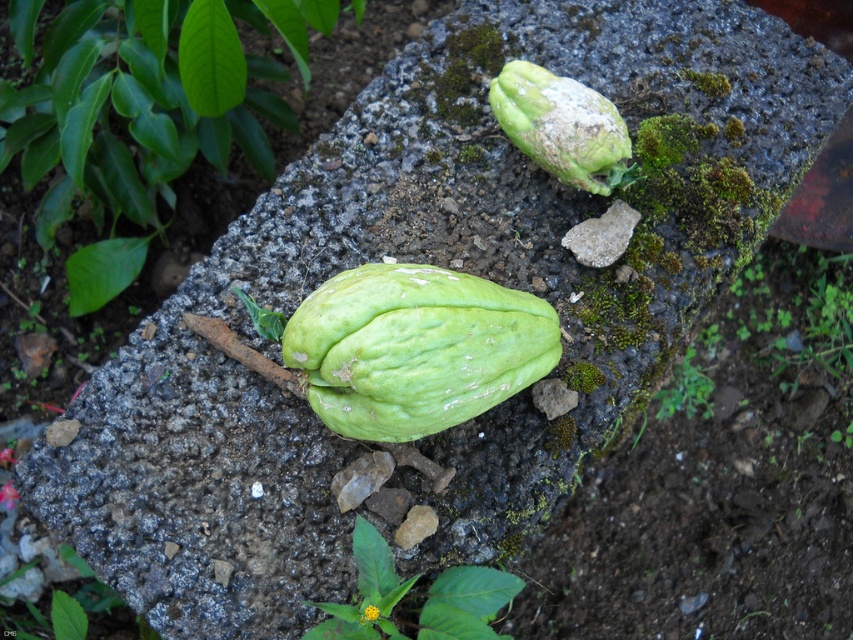
You are standing in a garden and see the green rough chayote at upper center and the green rough leaf at lower right. Which object is positioned more to the left side of the garden?

The green rough chayote at upper center is positioned more to the left side of the garden than the green rough leaf at lower right.